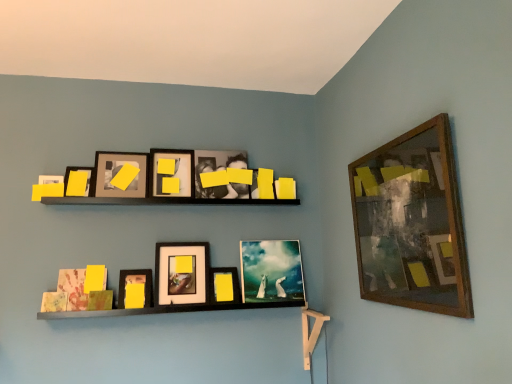
Question: From a real-world perspective, is yellow matte picture frame at center, which appears as the third picture frame when viewed from the right, positioned under matte black picture frame at upper left, positioned as the 1th picture frame in left-to-right order, based on gravity?

Choices:
 (A) no
 (B) yes

Answer: (B)

Question: Is yellow matte picture frame at center, which is counted as the seventh picture frame, starting from the left, not inside matte black picture frame at upper left, which is the 9th picture frame in right-to-left order?

Choices:
 (A) no
 (B) yes

Answer: (B)

Question: From the image's perspective, is yellow matte picture frame at center, which is counted as the seventh picture frame, starting from the left, above matte black picture frame at upper left, positioned as the 1th picture frame in left-to-right order?

Choices:
 (A) yes
 (B) no

Answer: (B)

Question: Would you say yellow matte picture frame at center, which appears as the third picture frame when viewed from the right, contains matte black picture frame at upper left, positioned as the 1th picture frame in left-to-right order?

Choices:
 (A) no
 (B) yes

Answer: (A)

Question: Does yellow matte picture frame at center, which appears as the third picture frame when viewed from the right, come behind matte black picture frame at upper left, which is the 9th picture frame in right-to-left order?

Choices:
 (A) yes
 (B) no

Answer: (A)

Question: Does point (141, 271) appear closer or farther from the camera than point (173, 281)?

Choices:
 (A) farther
 (B) closer

Answer: (A)

Question: From their relative heights in the image, would you say matte yellow paper at lower center, positioned as the 3th picture frame in left-to-right order, is taller or shorter than matte black picture frame at center, which ranks as the 5th picture frame in right-to-left order?

Choices:
 (A) short
 (B) tall

Answer: (A)

Question: Considering the positions of matte yellow paper at lower center, which ranks as the 7th picture frame in right-to-left order, and matte black picture frame at center, which ranks as the 5th picture frame in left-to-right order, in the image, is matte yellow paper at lower center, which ranks as the 7th picture frame in right-to-left order, bigger or smaller than matte black picture frame at center, which ranks as the 5th picture frame in left-to-right order,?

Choices:
 (A) big
 (B) small

Answer: (B)

Question: From a real-world perspective, is matte yellow paper at lower center, positioned as the 3th picture frame in left-to-right order, physically located above or below matte black picture frame at center, which ranks as the 5th picture frame in right-to-left order?

Choices:
 (A) above
 (B) below

Answer: (B)

Question: Is matte black picture frame at upper left, which appears as the 8th picture frame when viewed from the right, spatially inside wooden-framed artwork at upper right, placed as the ninth picture frame when sorted from left to right, or outside of it?

Choices:
 (A) outside
 (B) inside

Answer: (A)

Question: Is matte black picture frame at upper left, which ranks as the second picture frame in left-to-right order, wider or thinner than wooden-framed artwork at upper right, which appears as the 1th picture frame when viewed from the right?

Choices:
 (A) wide
 (B) thin

Answer: (A)

Question: Considering the positions of matte black picture frame at upper left, which appears as the 8th picture frame when viewed from the right, and wooden-framed artwork at upper right, which appears as the 1th picture frame when viewed from the right, in the image, is matte black picture frame at upper left, which appears as the 8th picture frame when viewed from the right, bigger or smaller than wooden-framed artwork at upper right, which appears as the 1th picture frame when viewed from the right,?

Choices:
 (A) small
 (B) big

Answer: (A)

Question: Would you say matte black picture frame at upper left, which ranks as the second picture frame in left-to-right order, is to the left or to the right of wooden-framed artwork at upper right, placed as the ninth picture frame when sorted from left to right, in the picture?

Choices:
 (A) left
 (B) right

Answer: (A)

Question: From a real-world perspective, is matte glass painting at center, the 8th picture frame in the left-to-right sequence, above or below wooden-framed artwork at upper right, which appears as the 1th picture frame when viewed from the right?

Choices:
 (A) below
 (B) above

Answer: (A)

Question: Is matte glass painting at center, the 8th picture frame in the left-to-right sequence, taller or shorter than wooden-framed artwork at upper right, placed as the ninth picture frame when sorted from left to right?

Choices:
 (A) short
 (B) tall

Answer: (A)